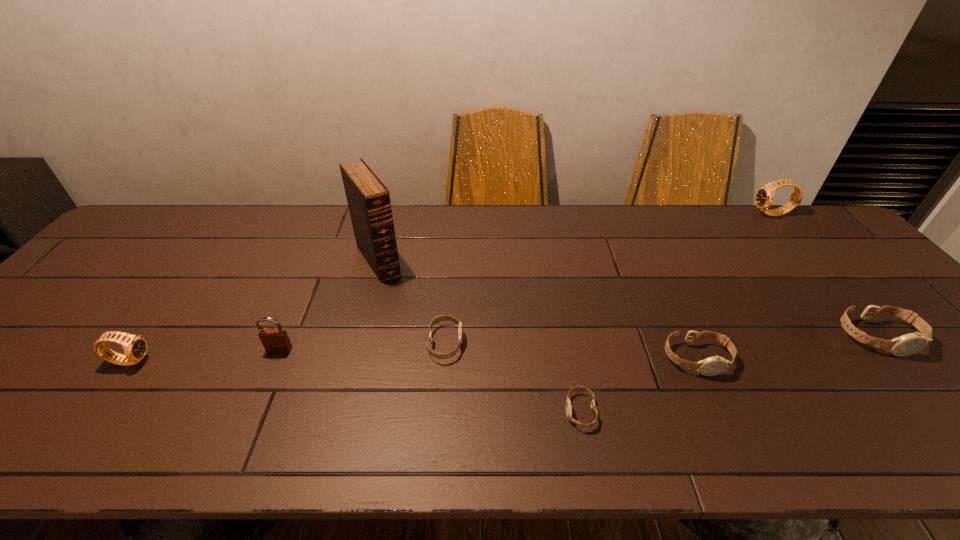
I want to click on the sixth tallest object, so click(x=711, y=366).

At what (x,y) coordinates should I click in order to perform the action: click on the third beige watch from left to right. Please return your answer as a coordinate pair (x, y). The width and height of the screenshot is (960, 540). Looking at the image, I should click on (711, 366).

Where is `the fourth object from left to right`? The image size is (960, 540). the fourth object from left to right is located at coordinates (437, 319).

Where is `the third biggest beige watch`? This screenshot has width=960, height=540. the third biggest beige watch is located at coordinates (437, 319).

Locate an element on the screen. The image size is (960, 540). the nearest object is located at coordinates (568, 403).

Locate an element on the screen. the nearest watch is located at coordinates (568, 403).

You are a GUI agent. You are given a task and a screenshot of the screen. Output one action in this format:
    pyautogui.click(x=<x>, y=<y>)
    Task: Click on the vacant space situated on the front of the tallest object
    This screenshot has height=540, width=960.
    Given the screenshot: What is the action you would take?
    349,370

This screenshot has height=540, width=960. I want to click on vacant area situated on the face of the farthest object, so click(x=730, y=214).

Identify the location of vacant region located 0.100m on the face of the farthest object. This screenshot has width=960, height=540. (724, 214).

What are the coordinates of `free space located 0.310m on the face of the farthest object` in the screenshot? It's located at (660, 214).